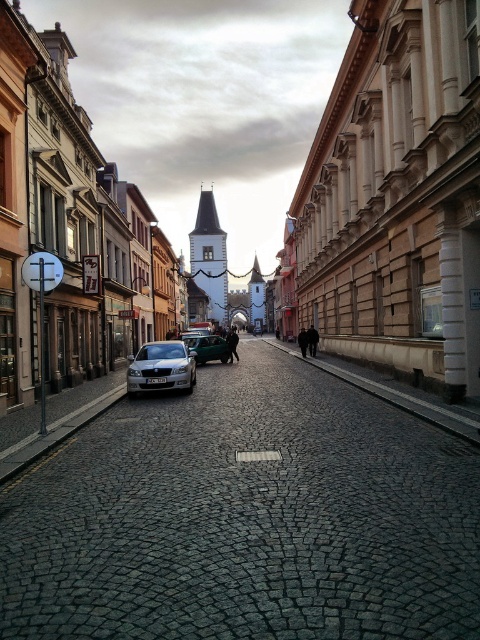
Consider the image. You are driving a car and need to park in the narrow cobblestone street. You see a silver metallic sedan at center and a metallic silver car at center. Which one is closer to the left side of the street?

The silver metallic sedan at center is closer to the left side of the street because it is positioned to the left of the metallic silver car at center.